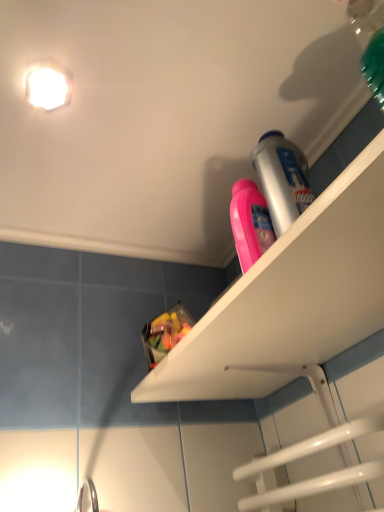
Identify the location of free space behind translucent plastic bag of candy at upper center. This screenshot has height=512, width=384. (196, 387).